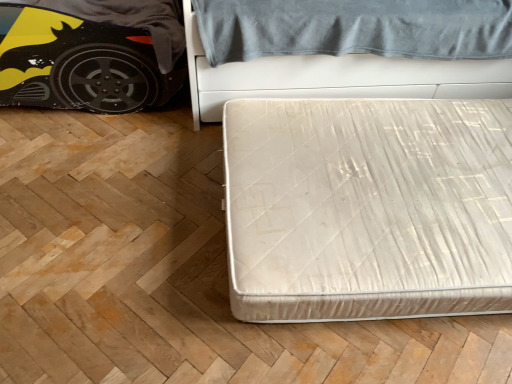
What are the coordinates of `matt black car at left` in the screenshot? It's located at (79, 64).

This screenshot has width=512, height=384. What are the coordinates of `white fabric mattress at lower right, which is the second bed in top-to-bottom order` in the screenshot? It's located at (368, 208).

Identify the location of white textured mattress at center, which is counted as the first bed, starting from the top. (334, 77).

Where is `matt black car at left`? matt black car at left is located at coordinates (79, 64).

Is point (331, 266) closer to camera compared to point (33, 64)?

That is True.

Considering their positions, is white fabric mattress at lower right, which is the second bed in top-to-bottom order, located in front of or behind matt black car at left?

white fabric mattress at lower right, which is the second bed in top-to-bottom order, is positioned closer to the viewer than matt black car at left.

Between white fabric mattress at lower right, which is the second bed in top-to-bottom order, and matt black car at left, which one has larger width?

Wider between the two is white fabric mattress at lower right, which is the second bed in top-to-bottom order.

Is white fabric mattress at lower right, which is the second bed in top-to-bottom order, smaller than matt black car at left?

→ Correct, white fabric mattress at lower right, which is the second bed in top-to-bottom order, occupies less space than matt black car at left.

Identify the location of car that appears below the white textured mattress at center, which is counted as the first bed, starting from the top (from the image's perspective). This screenshot has height=384, width=512. (79, 64).

From a real-world perspective, who is located lower, matt black car at left or white textured mattress at center, acting as the second bed starting from the bottom?

matt black car at left is physically lower.

Between matt black car at left and white textured mattress at center, acting as the second bed starting from the bottom, which one has less height?

Standing shorter between the two is matt black car at left.

Considering the sizes of objects matt black car at left and white textured mattress at center, which is counted as the first bed, starting from the top, in the image provided, who is wider, matt black car at left or white textured mattress at center, which is counted as the first bed, starting from the top,?

Wider between the two is white textured mattress at center, which is counted as the first bed, starting from the top.

From a real-world perspective, between matt black car at left and white fabric mattress at lower right, acting as the 1th bed starting from the bottom, who is vertically lower?

white fabric mattress at lower right, acting as the 1th bed starting from the bottom.

Is matt black car at left inside or outside of white fabric mattress at lower right, acting as the 1th bed starting from the bottom?

The correct answer is: outside.

Is matt black car at left oriented towards white fabric mattress at lower right, acting as the 1th bed starting from the bottom?

No, matt black car at left is not aimed at white fabric mattress at lower right, acting as the 1th bed starting from the bottom.

Is white textured mattress at center, which is counted as the first bed, starting from the top, turned away from matt black car at left?

No, white textured mattress at center, which is counted as the first bed, starting from the top,'s orientation is not away from matt black car at left.

Considering the points (443, 71) and (92, 102), which point is behind, point (443, 71) or point (92, 102)?

Point (92, 102)

Is white textured mattress at center, acting as the second bed starting from the bottom, closer to camera compared to matt black car at left?

Yes, it is in front of matt black car at left.

From a real-world perspective, is white textured mattress at center, which is counted as the first bed, starting from the top, beneath matt black car at left?

Actually, white textured mattress at center, which is counted as the first bed, starting from the top, is physically above matt black car at left in the real world.

How much distance is there between white fabric mattress at lower right, acting as the 1th bed starting from the bottom, and white textured mattress at center, which is counted as the first bed, starting from the top?

white fabric mattress at lower right, acting as the 1th bed starting from the bottom, and white textured mattress at center, which is counted as the first bed, starting from the top, are 47.86 centimeters apart from each other.

From a real-world perspective, is white fabric mattress at lower right, acting as the 1th bed starting from the bottom, below white textured mattress at center, acting as the second bed starting from the bottom?

Yes, from a real-world perspective, white fabric mattress at lower right, acting as the 1th bed starting from the bottom, is below white textured mattress at center, acting as the second bed starting from the bottom.

Considering the sizes of objects white fabric mattress at lower right, acting as the 1th bed starting from the bottom, and white textured mattress at center, which is counted as the first bed, starting from the top, in the image provided, who is wider, white fabric mattress at lower right, acting as the 1th bed starting from the bottom, or white textured mattress at center, which is counted as the first bed, starting from the top,?

white fabric mattress at lower right, acting as the 1th bed starting from the bottom, is wider.

You are a GUI agent. You are given a task and a screenshot of the screen. Output one action in this format:
    pyautogui.click(x=<x>, y=<y>)
    Task: Click on the bed above the white fabric mattress at lower right, acting as the 1th bed starting from the bottom (from the image's perspective)
    Image resolution: width=512 pixels, height=384 pixels.
    Given the screenshot: What is the action you would take?
    pyautogui.click(x=334, y=77)

Is white textured mattress at center, which is counted as the first bed, starting from the top, closer to camera compared to white fabric mattress at lower right, acting as the 1th bed starting from the bottom?

No, the depth of white textured mattress at center, which is counted as the first bed, starting from the top, is greater than that of white fabric mattress at lower right, acting as the 1th bed starting from the bottom.

From the image's perspective, is white textured mattress at center, which is counted as the first bed, starting from the top, over white fabric mattress at lower right, which is the second bed in top-to-bottom order?

Yes.

Is white textured mattress at center, acting as the second bed starting from the bottom, with white fabric mattress at lower right, acting as the 1th bed starting from the bottom?

No, white textured mattress at center, acting as the second bed starting from the bottom, is not touching white fabric mattress at lower right, acting as the 1th bed starting from the bottom.

Does white textured mattress at center, acting as the second bed starting from the bottom, appear on the right side of white fabric mattress at lower right, acting as the 1th bed starting from the bottom?

Yes.

This screenshot has width=512, height=384. Identify the location of the 1st bed to the right of the matt black car at left, starting your count from the anchor. (368, 208).

In order to click on bed that is above the matt black car at left (from a real-world perspective) in this screenshot , I will do `click(334, 77)`.

From the image, which object appears to be farther from white fabric mattress at lower right, which is the second bed in top-to-bottom order, matt black car at left or white textured mattress at center, which is counted as the first bed, starting from the top?

matt black car at left is positioned further to the anchor white fabric mattress at lower right, which is the second bed in top-to-bottom order.

Estimate the real-world distances between objects in this image. Which object is further from white fabric mattress at lower right, acting as the 1th bed starting from the bottom, white textured mattress at center, which is counted as the first bed, starting from the top, or matt black car at left?

Based on the image, matt black car at left appears to be further to white fabric mattress at lower right, acting as the 1th bed starting from the bottom.

From the image, which object appears to be nearer to matt black car at left, white fabric mattress at lower right, which is the second bed in top-to-bottom order, or white textured mattress at center, acting as the second bed starting from the bottom?

white textured mattress at center, acting as the second bed starting from the bottom, lies closer to matt black car at left than the other object.

From the picture: Considering their positions, is matt black car at left positioned further to white textured mattress at center, which is counted as the first bed, starting from the top, than white fabric mattress at lower right, which is the second bed in top-to-bottom order?

matt black car at left is positioned further to the anchor white textured mattress at center, which is counted as the first bed, starting from the top.

When comparing their distances from matt black car at left, does white textured mattress at center, which is counted as the first bed, starting from the top, or white fabric mattress at lower right, acting as the 1th bed starting from the bottom, seem further?

white fabric mattress at lower right, acting as the 1th bed starting from the bottom, is positioned further to the anchor matt black car at left.

From the picture: When comparing their distances from white textured mattress at center, which is counted as the first bed, starting from the top, does white fabric mattress at lower right, which is the second bed in top-to-bottom order, or matt black car at left seem closer?

Based on the image, white fabric mattress at lower right, which is the second bed in top-to-bottom order, appears to be nearer to white textured mattress at center, which is counted as the first bed, starting from the top.

This screenshot has width=512, height=384. Identify the location of bed located between matt black car at left and white textured mattress at center, acting as the second bed starting from the bottom, in the left-right direction. point(368,208).